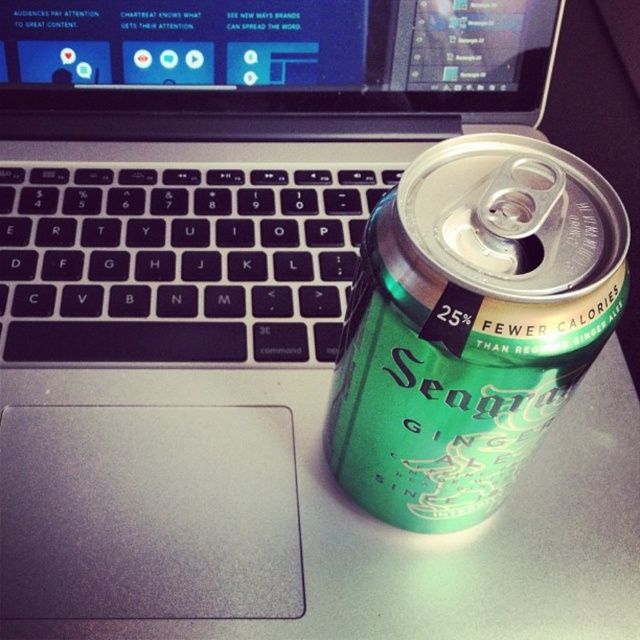
Between point (422, 189) and point (259, 340), which one is positioned in front?

Point (422, 189) is in front.

Does green metallic can at right appear under black matte keyboard at left?

Yes, green metallic can at right is below black matte keyboard at left.

Identify the location of green metallic can at right. The height and width of the screenshot is (640, 640). (470, 324).